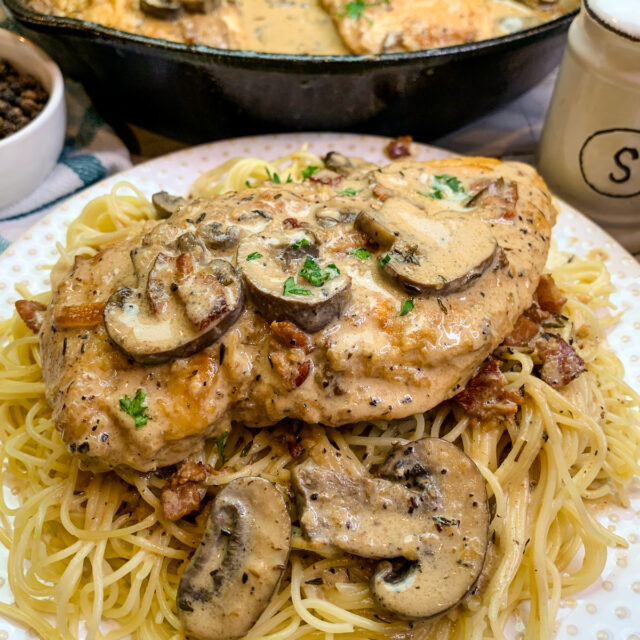
This screenshot has height=640, width=640. In order to click on salt shaker in this screenshot , I will do `click(605, 153)`.